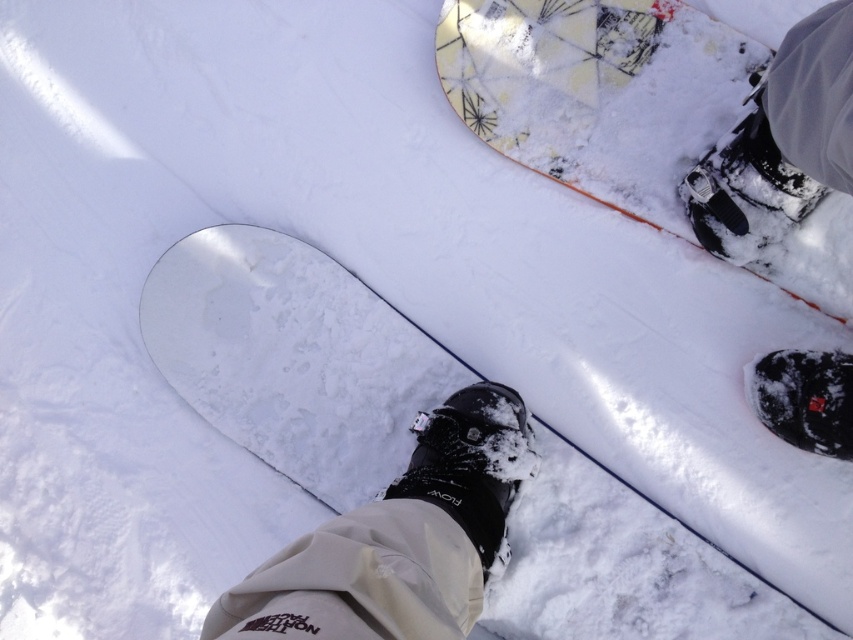
Question: Among these objects, which one is farthest from the camera?

Choices:
 (A) black matte boot at center
 (B) white matte snowboard at center
 (C) black matte boot at lower center
 (D) matte black boot at upper right

Answer: (B)

Question: Can you confirm if white matte snowboard at center is positioned to the right of black matte snowboard at lower right?

Choices:
 (A) no
 (B) yes

Answer: (A)

Question: Observing the image, what is the correct spatial positioning of black matte boot at center in reference to black matte boot at lower right?

Choices:
 (A) below
 (B) above

Answer: (A)

Question: Considering the real-world distances, which object is farthest from the black matte boot at center?

Choices:
 (A) black matte boot at lower center
 (B) matte black boot at upper right
 (C) black matte snowboard at lower right
 (D) white matte snowboard at center

Answer: (C)

Question: Which point appears farthest from the camera in this image?

Choices:
 (A) (849, 76)
 (B) (268, 579)
 (C) (219, 371)

Answer: (C)

Question: Does yellow-patterned plastic snowboard at upper right appear under black matte snowboard at lower right?

Choices:
 (A) no
 (B) yes

Answer: (A)